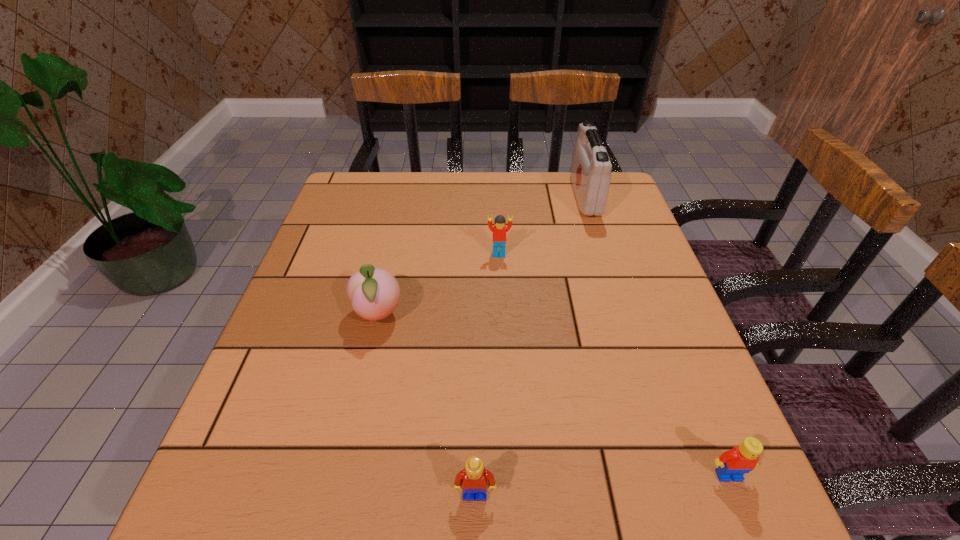
Locate an element on the screen. The height and width of the screenshot is (540, 960). free space located 0.210m on the front side of the tallest object is located at coordinates (503, 197).

This screenshot has height=540, width=960. I want to click on free region located on the back of the leftmost object, so click(393, 251).

This screenshot has height=540, width=960. I want to click on free region located on the face of the farthest Lego, so click(505, 372).

The width and height of the screenshot is (960, 540). Find the location of `object that is at the far edge`. object that is at the far edge is located at coordinates (591, 168).

Where is `object positioned at the left edge`? The height and width of the screenshot is (540, 960). object positioned at the left edge is located at coordinates (374, 293).

Locate an element on the screen. The image size is (960, 540). the first-aid kit at the right edge is located at coordinates (591, 168).

Locate an element on the screen. Lego positioned at the right edge is located at coordinates (732, 464).

Where is `object at the far right corner`? object at the far right corner is located at coordinates (591, 168).

This screenshot has width=960, height=540. I want to click on object located in the near right corner section of the desktop, so click(732, 464).

Where is `vacant area at the far edge`? vacant area at the far edge is located at coordinates (543, 173).